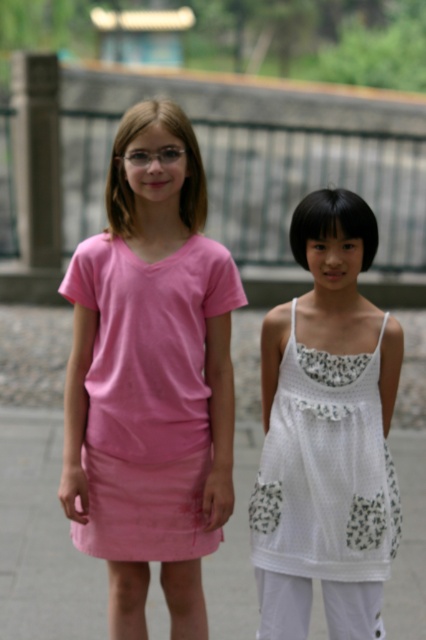
You are a fashion designer analyzing the outfits in the image. Which of the two outfits, the pink fabric skirt at lower center or the white crochet dress at center, has a wider silhouette?

The pink fabric skirt at lower center has a wider silhouette than the white crochet dress at center.

You are a photographer trying to capture a candid shot of both the matte pink dress at center and the white sleeveless top with floral pattern on the right. The minimum distance required for your camera to focus properly is 5 meters. Based on their current positions, will your camera be able to capture both subjects clearly in one shot?

The individuals are 4.70 meters apart, which is less than the 5 meters required for the camera to focus properly. Therefore, the camera may not be able to capture both subjects clearly in one shot due to the insufficient distance between them.